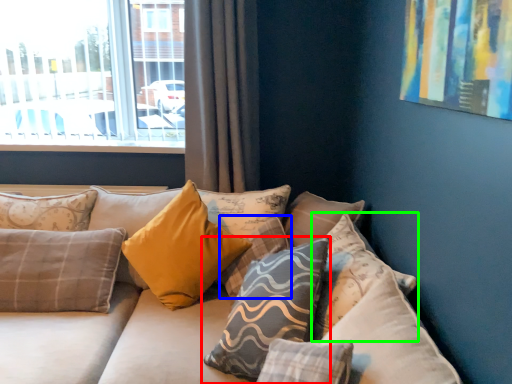
Question: Which object is positioned closest to pillow (highlighted by a red box)? Select from pillow (highlighted by a blue box) and pillow (highlighted by a green box).

Choices:
 (A) pillow
 (B) pillow

Answer: (B)